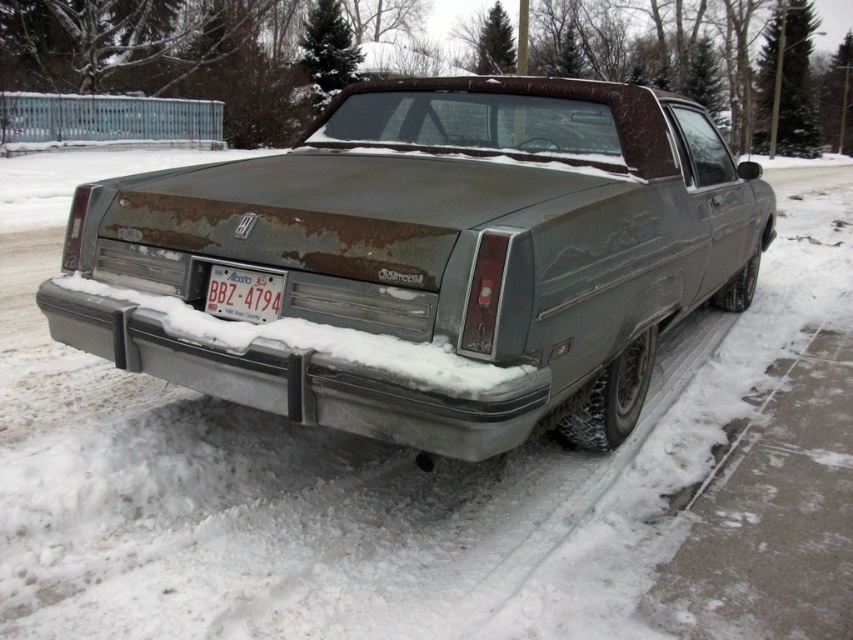
Question: Does rusty metal car at center appear on the right side of white plastic license plate at center?

Choices:
 (A) no
 (B) yes

Answer: (B)

Question: In this image, where is rusty metal car at center located relative to white plastic license plate at center?

Choices:
 (A) right
 (B) left

Answer: (A)

Question: Which of the following is the farthest from the observer?

Choices:
 (A) (492, 196)
 (B) (247, 284)

Answer: (B)

Question: Which point is farther from the camera taking this photo?

Choices:
 (A) (80, 246)
 (B) (241, 312)

Answer: (A)

Question: Does rusty metal car at center appear on the right side of white plastic license plate at center?

Choices:
 (A) yes
 (B) no

Answer: (A)

Question: Which object is farther from the camera taking this photo?

Choices:
 (A) rusty metal car at center
 (B) white plastic license plate at center

Answer: (B)